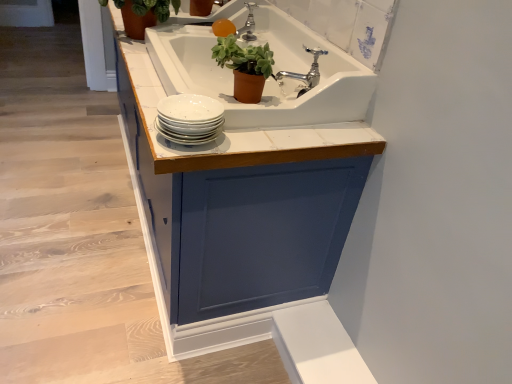
The width and height of the screenshot is (512, 384). I want to click on empty space that is ontop of white glossy cabinet at upper center (from a real-world perspective), so click(x=71, y=204).